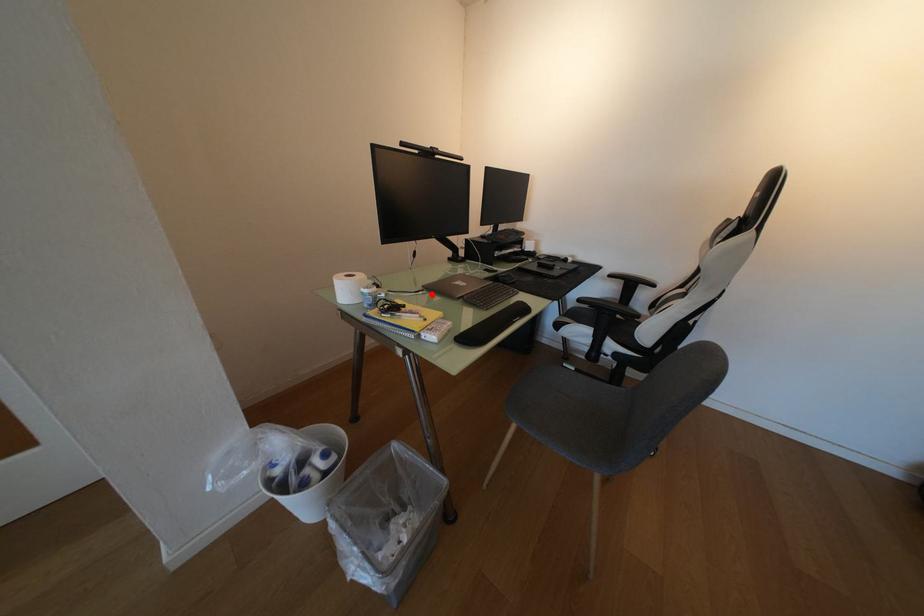
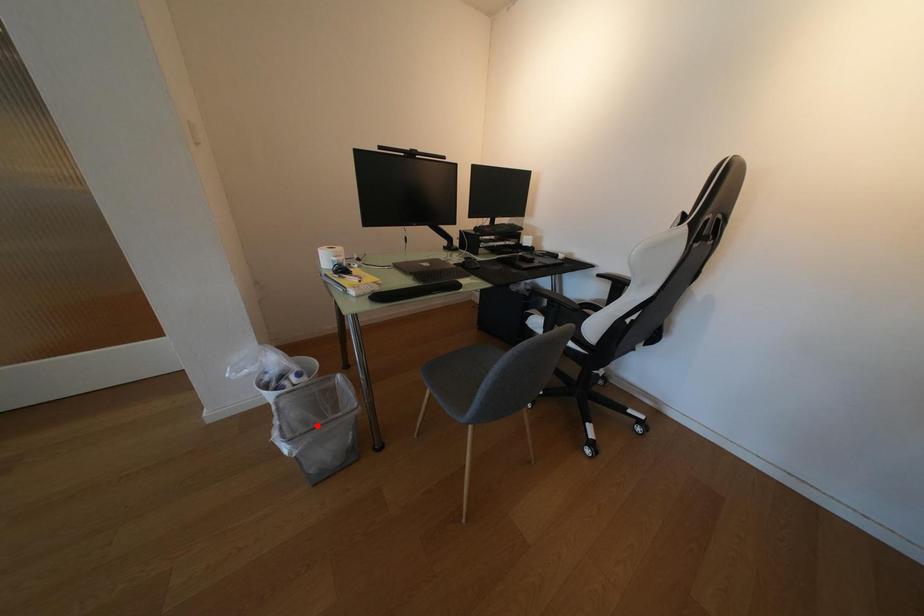
I am providing you with two images of the same scene from different viewpoints. A red point is marked on the first image and another point is marked on the second image. Does the point marked in image1 correspond to the same location as the one in image2?

No